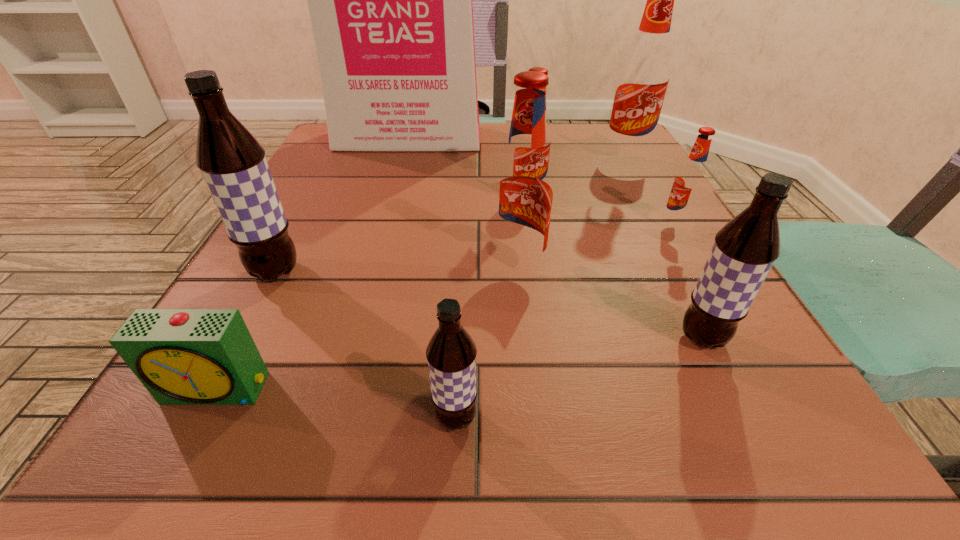
Locate an element on the screen. shopping bag that is at the left edge is located at coordinates (390, 0).

This screenshot has height=540, width=960. Identify the location of root beer that is at the left edge. (233, 164).

Find the location of a particular element. The width and height of the screenshot is (960, 540). alarm clock at the left edge is located at coordinates (182, 356).

Locate an element on the screen. The image size is (960, 540). object that is positioned at the far left corner is located at coordinates pyautogui.click(x=390, y=0).

Find the location of a particular element. The width and height of the screenshot is (960, 540). object that is at the near left corner is located at coordinates (182, 356).

At what (x,y) coordinates should I click in order to perform the action: click on object that is at the far right corner. Please return your answer as a coordinate pair (x, y). The image size is (960, 540). Looking at the image, I should click on (644, 74).

Locate an element on the screen. The width and height of the screenshot is (960, 540). vacant space at the far edge of the desktop is located at coordinates (493, 152).

Identify the location of vacant space at the near edge of the desktop. This screenshot has width=960, height=540. (371, 468).

In the image, there is a desktop. Where is `vacant space at the left edge`? vacant space at the left edge is located at coordinates (268, 308).

The height and width of the screenshot is (540, 960). In order to click on free space at the right edge in this screenshot , I will do `click(687, 231)`.